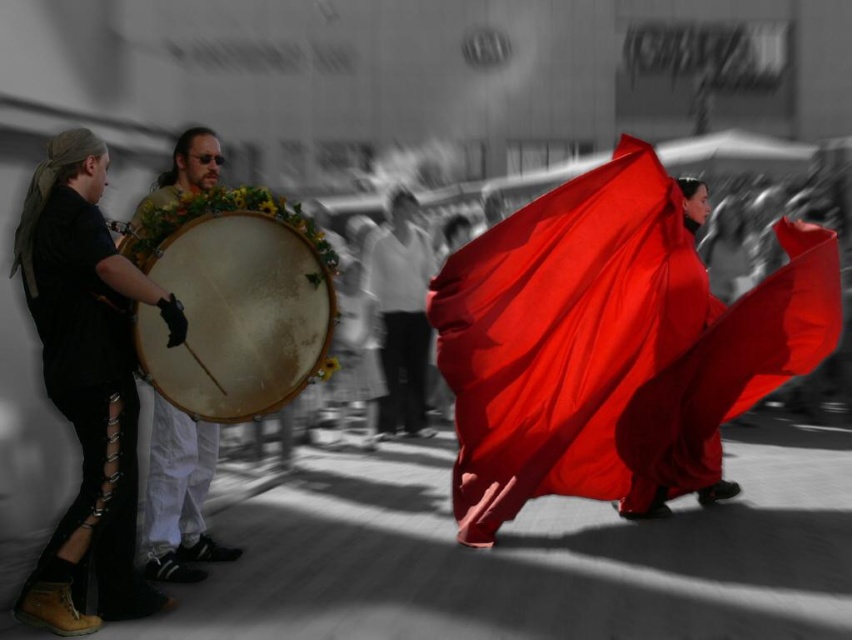
Does matte red fabric at center have a greater height compared to wooden drum at left?

Yes, matte red fabric at center is taller than wooden drum at left.

Who is lower down, matte red fabric at center or wooden drum at left?

wooden drum at left is lower down.

Between point (628, 198) and point (190, 148), which one is positioned in front?

Point (190, 148)

This screenshot has width=852, height=640. I want to click on matte red fabric at center, so click(612, 346).

Between matte red fabric at center and wooden drum at center, which one appears on the left side from the viewer's perspective?

wooden drum at center

Can you confirm if matte red fabric at center is positioned above wooden drum at center?

No.

Is point (684, 304) in front of point (295, 336)?

That is False.

Image resolution: width=852 pixels, height=640 pixels. In order to click on matte red fabric at center in this screenshot , I will do `click(612, 346)`.

Who is lower down, wooden drum at center or smooth white shirt at center?

wooden drum at center is lower down.

Measure the distance from wooden drum at center to smooth white shirt at center.

wooden drum at center is 4.04 meters away from smooth white shirt at center.

Who is more forward, (234, 241) or (390, 412)?

Point (234, 241) is more forward.

Locate an element on the screen. The height and width of the screenshot is (640, 852). wooden drum at center is located at coordinates (237, 316).